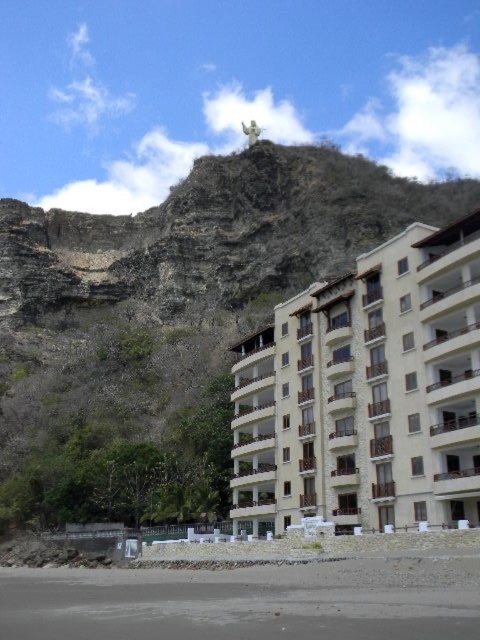
You are a tourist standing on the beach looking at the beige stone building at center and the brown rocky mountain at upper center. Which one appears larger in size?

The brown rocky mountain at upper center appears larger than the beige stone building at center.

Consider the image. You are a tourist standing on the beach looking at the beige stone building at center and the brown rocky mountain at upper center. Which object is higher in elevation from your viewpoint?

The brown rocky mountain at upper center is higher in elevation than the beige stone building at center from your viewpoint because it is positioned above the building in the scene.

You are a tourist standing on the beach looking at the beige stone building at center. Which direction should you walk to reach the brown rocky mountain at upper center?

The brown rocky mountain at upper center is to the left of the beige stone building at center, so you should walk to the left to reach it.